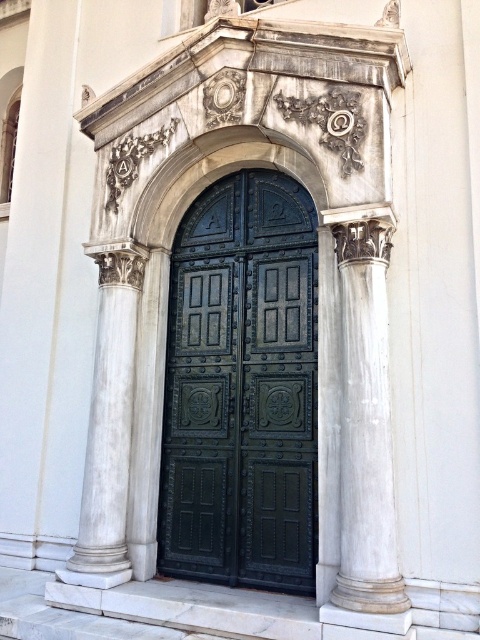
Question: Which object is the farthest from the white marble column at right?

Choices:
 (A) white marble column at left
 (B) green polished wood door at center

Answer: (A)

Question: Does green polished wood door at center have a smaller size compared to white marble column at right?

Choices:
 (A) no
 (B) yes

Answer: (A)

Question: Among these objects, which one is nearest to the camera?

Choices:
 (A) green polished wood door at center
 (B) white marble column at left

Answer: (A)

Question: Among these points, which one is nearest to the camera?

Choices:
 (A) (98, 358)
 (B) (360, 326)
 (C) (276, 426)

Answer: (B)

Question: Does white marble column at right have a smaller size compared to white marble column at left?

Choices:
 (A) yes
 (B) no

Answer: (A)

Question: Where is white marble column at right located in relation to white marble column at left in the image?

Choices:
 (A) below
 (B) above

Answer: (B)